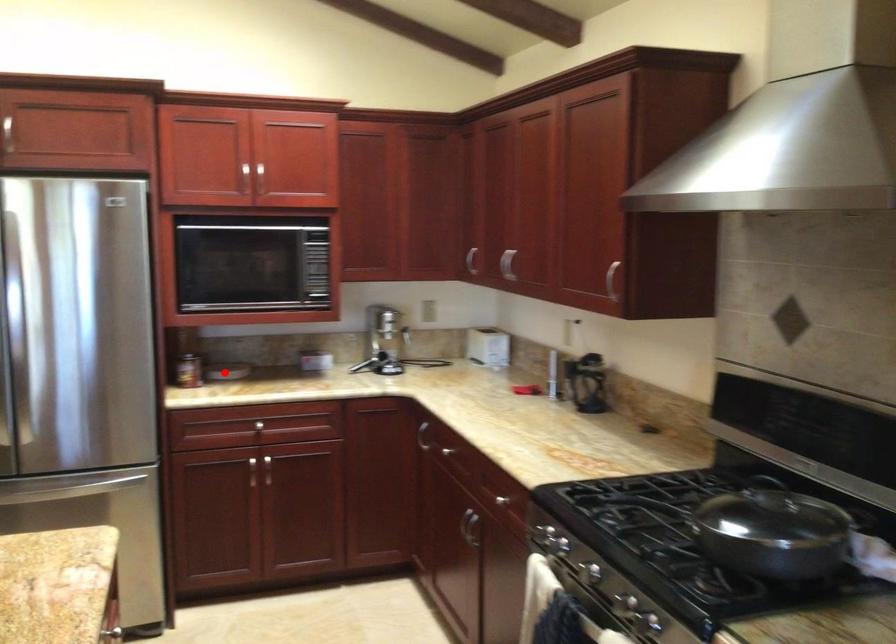
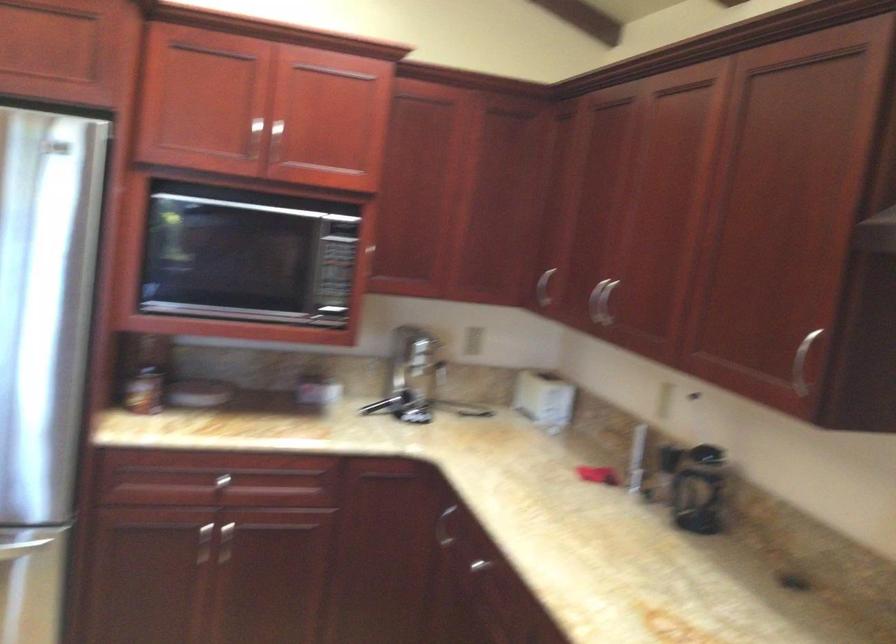
Question: I am providing you with two images of the same scene from different viewpoints. Image1 has a red point marked. In image2, the corresponding 3D location appears at what relative position? Reply with the corresponding letter.

Choices:
 (A) Closer
 (B) Farther

Answer: (A)